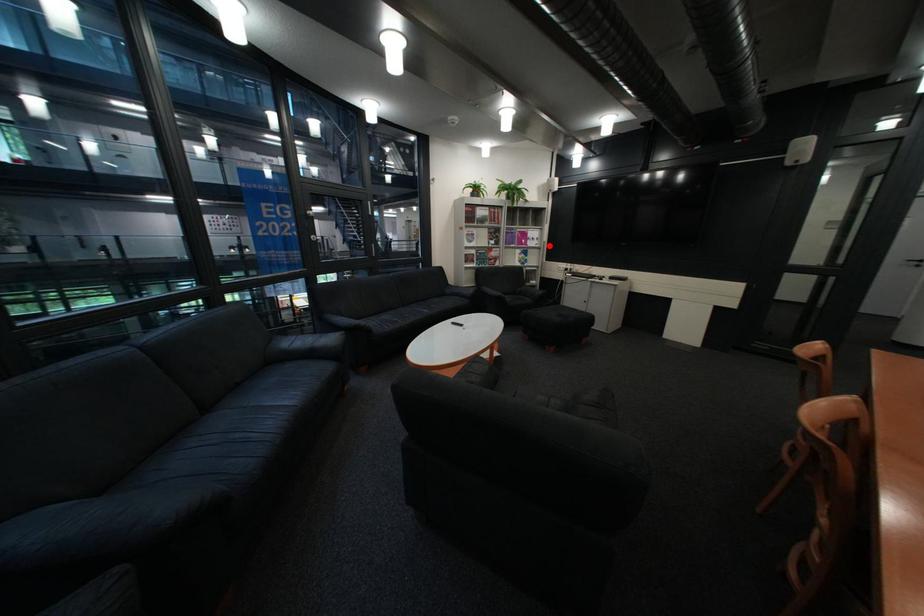
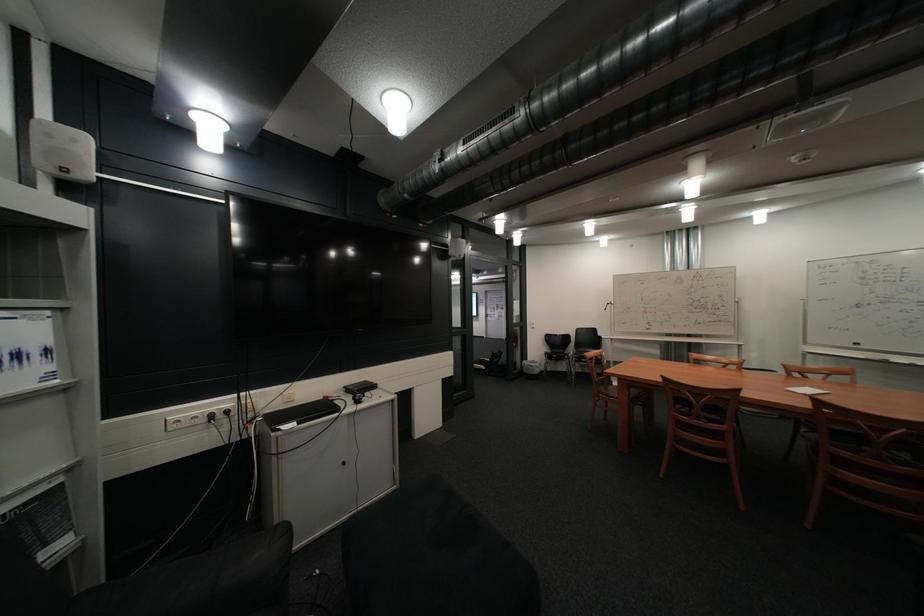
Where in the second image is the point corresponding to the highlighted location from the first image?

(46, 386)